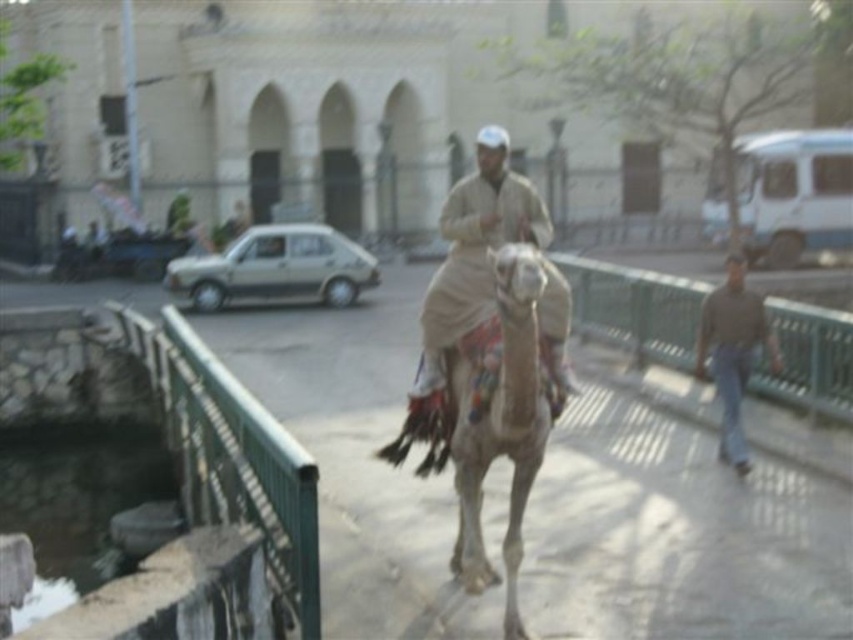
You are standing on the bridge and want to take a photo of the white textured camel at center and the brown cotton shirt at right. Which object should you focus on first to ensure both are in the frame?

You should focus on the white textured camel at center first because it is closer to the viewer than the brown cotton shirt at right, so adjusting the camera to capture it ensures the shirt will also be in the frame.